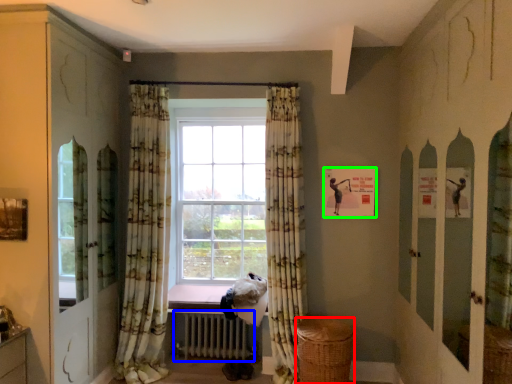
Question: Which object is positioned farthest from basket (highlighted by a red box)? Select from radiator (highlighted by a blue box) and picture frame (highlighted by a green box).

Choices:
 (A) radiator
 (B) picture frame

Answer: (B)